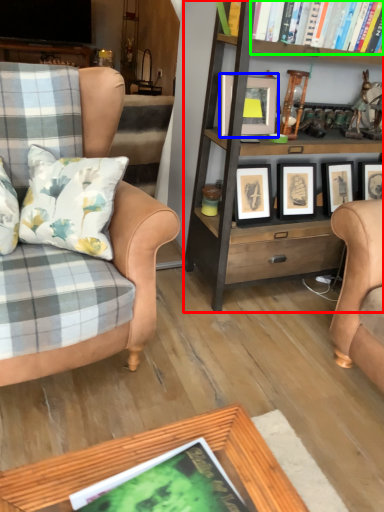
Question: Which object is positioned closest to bookcase (highlighted by a red box)? Select from picture frame (highlighted by a blue box) and book (highlighted by a green box).

Choices:
 (A) picture frame
 (B) book

Answer: (A)